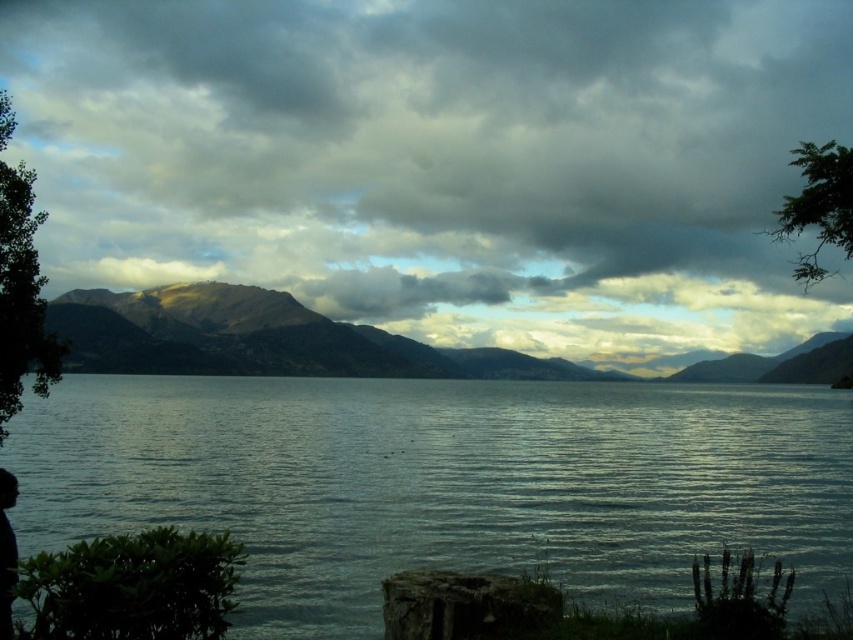
Is rugged brown mountain at center above green leafy bush at lower left?

No, rugged brown mountain at center is not above green leafy bush at lower left.

Can you confirm if rugged brown mountain at center is smaller than green leafy bush at lower left?

No, rugged brown mountain at center is not smaller than green leafy bush at lower left.

Does point (234, 307) lie in front of point (119, 605)?

That is False.

You are a GUI agent. You are given a task and a screenshot of the screen. Output one action in this format:
    pyautogui.click(x=<x>, y=<y>)
    Task: Click on the rugged brown mountain at center
    
    Given the screenshot: What is the action you would take?
    pyautogui.click(x=263, y=339)

Which of these two, green leafy bush at lower left or green leafy tree at left, stands shorter?

green leafy bush at lower left is shorter.

Between green leafy bush at lower left and green leafy tree at left, which one is positioned lower?

Positioned lower is green leafy bush at lower left.

This screenshot has height=640, width=853. I want to click on green leafy bush at lower left, so click(132, 586).

Between cloudy sky at upper center and green leafy bush at lower left, which one is positioned lower?

green leafy bush at lower left is below.

Between cloudy sky at upper center and green leafy bush at lower left, which one appears on the right side from the viewer's perspective?

Positioned to the right is green leafy bush at lower left.

Locate an element on the screen. cloudy sky at upper center is located at coordinates (428, 147).